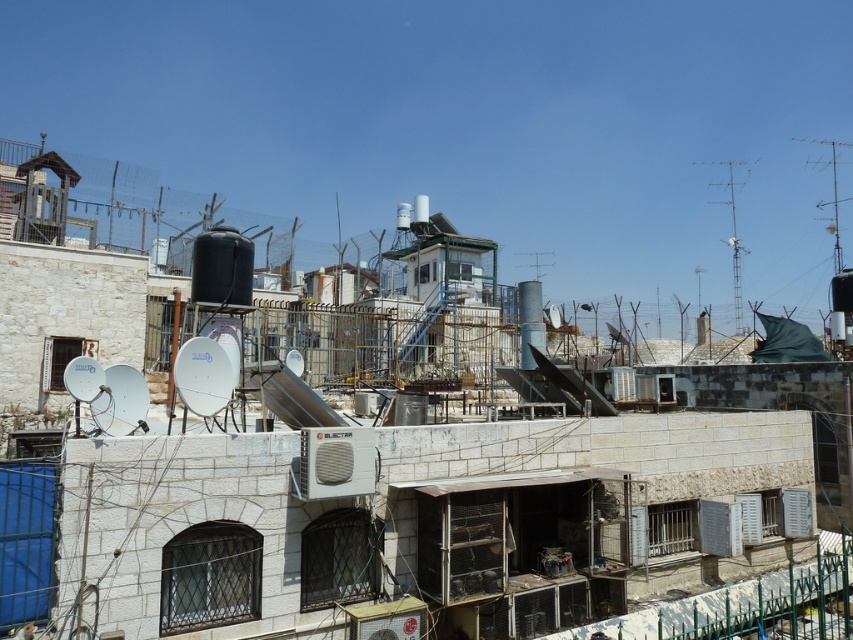
Is point (430, 244) in front of point (693, 161)?

Yes, it is in front of point (693, 161).

Can you confirm if metallic gray solar panel at center is smaller than metallic silver dish antenna at upper right?

Indeed, metallic gray solar panel at center has a smaller size compared to metallic silver dish antenna at upper right.

Where is `metallic gray solar panel at center`? This screenshot has height=640, width=853. metallic gray solar panel at center is located at coordinates (x=434, y=237).

I want to click on metallic gray solar panel at center, so click(434, 237).